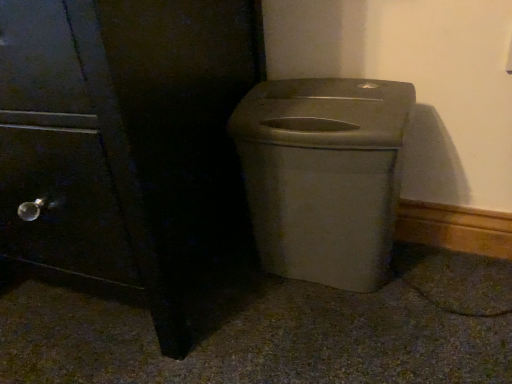
What is the approximate height of matte black side cabinet at left?

The height of matte black side cabinet at left is 22.87 inches.

What are the coordinates of `matte black side cabinet at left` in the screenshot? It's located at (125, 141).

Measure the distance between point [212,23] and camera.

Point [212,23] is 28.15 inches from camera.

Image resolution: width=512 pixels, height=384 pixels. What do you see at coordinates (125, 141) in the screenshot?
I see `matte black side cabinet at left` at bounding box center [125, 141].

The height and width of the screenshot is (384, 512). What do you see at coordinates (324, 175) in the screenshot?
I see `matte plastic trash can at center` at bounding box center [324, 175].

I want to click on matte plastic trash can at center, so click(324, 175).

Locate an element on the screen. The image size is (512, 384). matte black side cabinet at left is located at coordinates (125, 141).

Which is more to the left, matte plastic trash can at center or matte black side cabinet at left?

matte black side cabinet at left is more to the left.

Which is behind, matte plastic trash can at center or matte black side cabinet at left?

matte plastic trash can at center is further from the camera.

Does point (381, 155) come farther from viewer compared to point (31, 45)?

Yes, point (381, 155) is farther from viewer.

From the image's perspective, which is above, matte plastic trash can at center or matte black side cabinet at left?

matte black side cabinet at left appears higher in the image.

From a real-world perspective, is matte plastic trash can at center above or below matte black side cabinet at left?

From a real-world perspective, matte plastic trash can at center is physically below matte black side cabinet at left.

Can you confirm if matte plastic trash can at center is thinner than matte black side cabinet at left?

Indeed, matte plastic trash can at center has a lesser width compared to matte black side cabinet at left.

Which of these two, matte plastic trash can at center or matte black side cabinet at left, stands taller?

Standing taller between the two is matte black side cabinet at left.

Considering the sizes of objects matte plastic trash can at center and matte black side cabinet at left in the image provided, who is bigger, matte plastic trash can at center or matte black side cabinet at left?

matte black side cabinet at left is bigger.

Is matte plastic trash can at center inside or outside of matte black side cabinet at left?

matte plastic trash can at center is outside matte black side cabinet at left.

Can you see matte plastic trash can at center touching matte black side cabinet at left?

They are not placed beside each other.

Is matte plastic trash can at center positioned with its back to matte black side cabinet at left?

No.

I want to click on waste container that appears below the matte black side cabinet at left (from the image's perspective), so click(x=324, y=175).

Which object is positioned more to the left, matte black side cabinet at left or matte plastic trash can at center?

From the viewer's perspective, matte black side cabinet at left appears more on the left side.

Which object is closer to the camera, matte black side cabinet at left or matte plastic trash can at center?

Positioned in front is matte black side cabinet at left.

Between point (224, 104) and point (365, 152), which one is positioned in front?

Point (365, 152)

From the image's perspective, which object appears higher, matte black side cabinet at left or matte plastic trash can at center?

matte black side cabinet at left appears higher in the image.

From a real-world perspective, is matte black side cabinet at left on matte plastic trash can at center?

Yes, from a real-world perspective, matte black side cabinet at left is above matte plastic trash can at center.

From the picture: Is matte black side cabinet at left wider than matte plastic trash can at center?

Yes.

Is matte black side cabinet at left shorter than matte plastic trash can at center?

No, matte black side cabinet at left is not shorter than matte plastic trash can at center.

Considering the relative sizes of matte black side cabinet at left and matte plastic trash can at center in the image provided, is matte black side cabinet at left smaller than matte plastic trash can at center?

No.

Is matte black side cabinet at left inside the boundaries of matte plastic trash can at center, or outside?

The correct answer is: outside.

Is there a large distance between matte black side cabinet at left and matte plastic trash can at center?

No, there isn't a large distance between matte black side cabinet at left and matte plastic trash can at center.

In the scene shown: Is matte black side cabinet at left facing towards matte plastic trash can at center?

No, matte black side cabinet at left does not turn towards matte plastic trash can at center.

Locate an element on the screen. side cabinet on the left of matte plastic trash can at center is located at coordinates (125, 141).

Find the location of a particular element. The width and height of the screenshot is (512, 384). waste container below the matte black side cabinet at left (from a real-world perspective) is located at coordinates (324, 175).

The height and width of the screenshot is (384, 512). I want to click on side cabinet above the matte plastic trash can at center (from the image's perspective), so click(x=125, y=141).